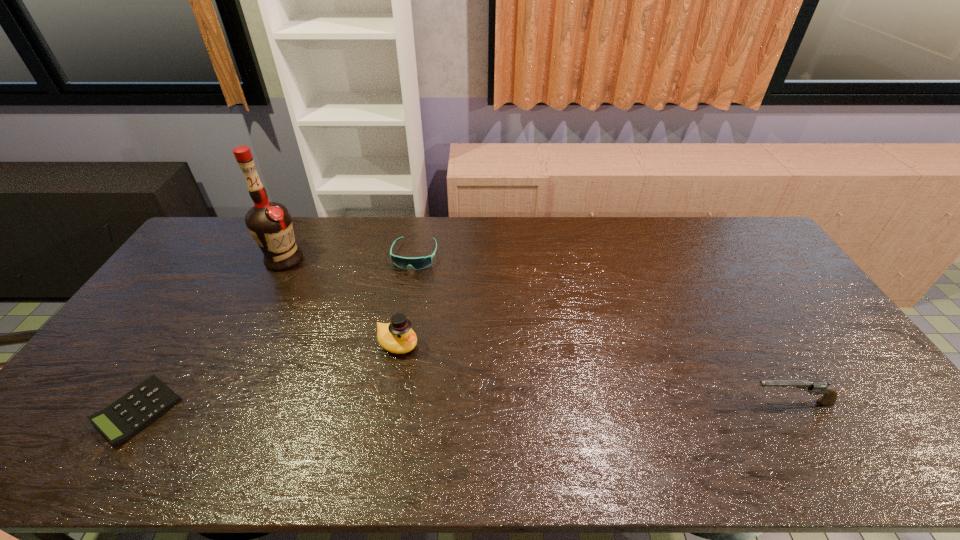
You are a GUI agent. You are given a task and a screenshot of the screen. Output one action in this format:
    pyautogui.click(x=<x>, y=<y>)
    Task: Click on the free space on the desktop that is between the calculator and the third tallest object and is positioned on the front-facing side of the fourth shortest object
    The image size is (960, 540).
    Given the screenshot: What is the action you would take?
    pyautogui.click(x=504, y=406)

Locate an element on the screen. free space on the desktop that is between the shortest object and the gun and is positioned on the front and back of the liquor is located at coordinates (390, 407).

Locate an element on the screen. The image size is (960, 540). vacant spot on the desktop that is between the leftmost object and the third tallest object and is positioned on the front-facing side of the second shortest object is located at coordinates [372, 408].